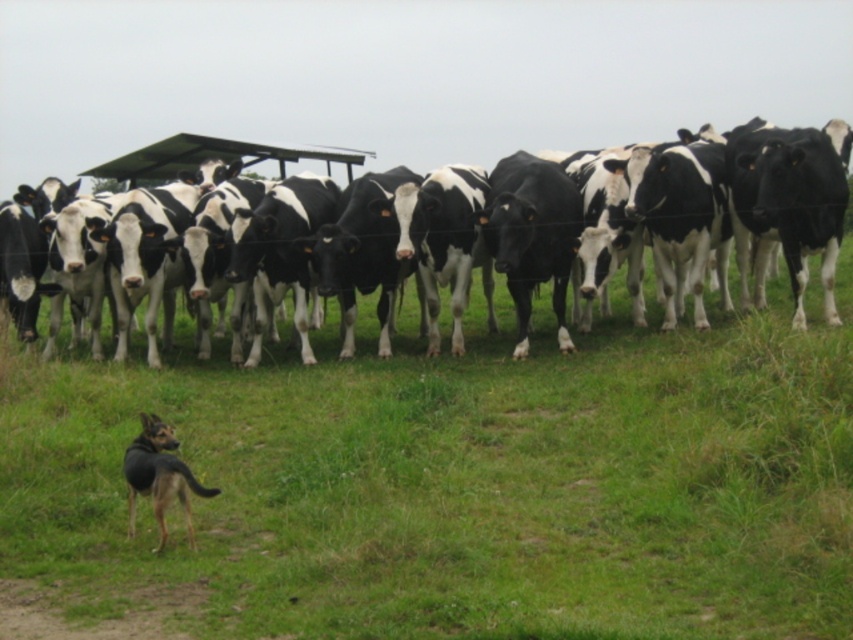
You are a farmer who needs to move your dog to herd the cows. The dog can run 10 meters per second. How long will it take for the brown fur dog at lower left to reach the black and white cows at center?

The distance between the brown fur dog at lower left and the black and white cows at center is 5.94 meters. Since the dog can run at 10 meters per second, it will take approximately 0.594 seconds to reach them.